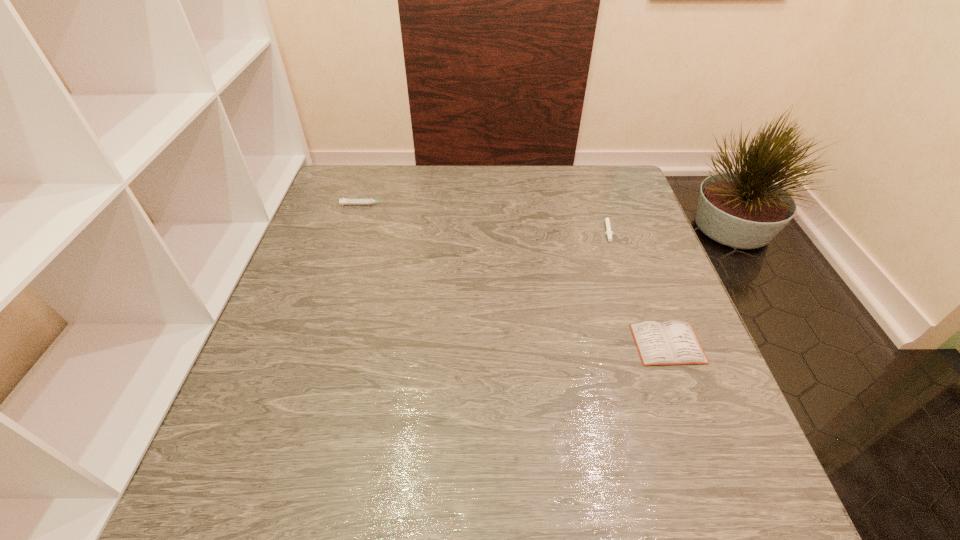
Find the location of `the leftmost object`. the leftmost object is located at coordinates (361, 201).

I want to click on the left syringe, so click(x=361, y=201).

The height and width of the screenshot is (540, 960). Find the location of `the second farthest object`. the second farthest object is located at coordinates (608, 232).

Locate an element on the screen. This screenshot has width=960, height=540. the shorter syringe is located at coordinates (608, 232).

Locate an element on the screen. the nearest object is located at coordinates [672, 342].

Locate an element on the screen. Image resolution: width=960 pixels, height=540 pixels. free region located at the needle end of the tallest object is located at coordinates (445, 205).

Identify the location of free space located on the front of the second nearest object. (636, 320).

You are a GUI agent. You are given a task and a screenshot of the screen. Output one action in this format:
    pyautogui.click(x=<x>, y=<y>)
    Task: Click on the vacant region located 0.120m on the left of the nearest object
    The width and height of the screenshot is (960, 540).
    Given the screenshot: What is the action you would take?
    click(x=577, y=343)

Find the location of a particular element. The image size is (960, 540). object that is at the far edge is located at coordinates (361, 201).

At what (x,y) coordinates should I click in order to perform the action: click on object at the left edge. Please return your answer as a coordinate pair (x, y). Looking at the image, I should click on (361, 201).